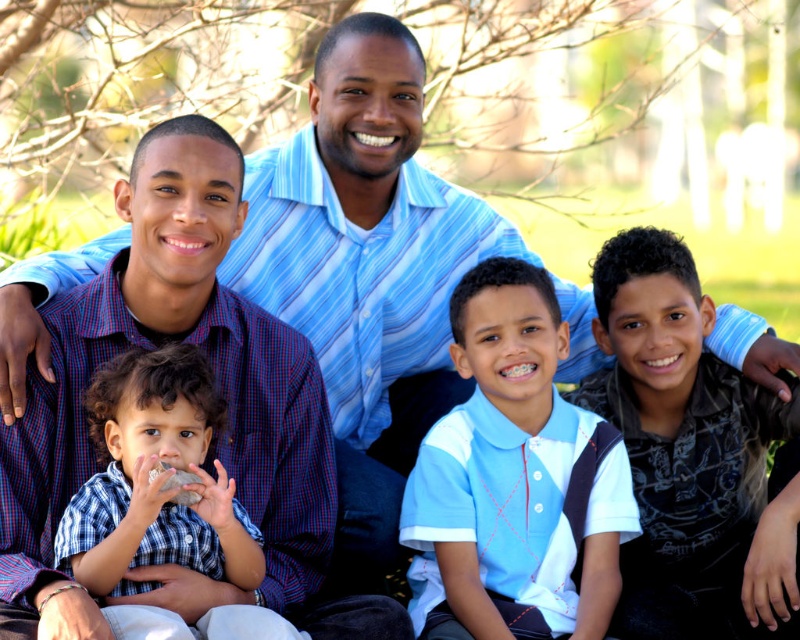
You are a photographer trying to capture the family photo. You notice the light blue cotton polo shirt at center and the dark blue printed shirt at center. Which shirt should you focus on to ensure it takes up more space in your photo?

The dark blue printed shirt at center occupies more space than the light blue cotton polo shirt at center, so focusing on it would ensure it takes up more space in the photo.